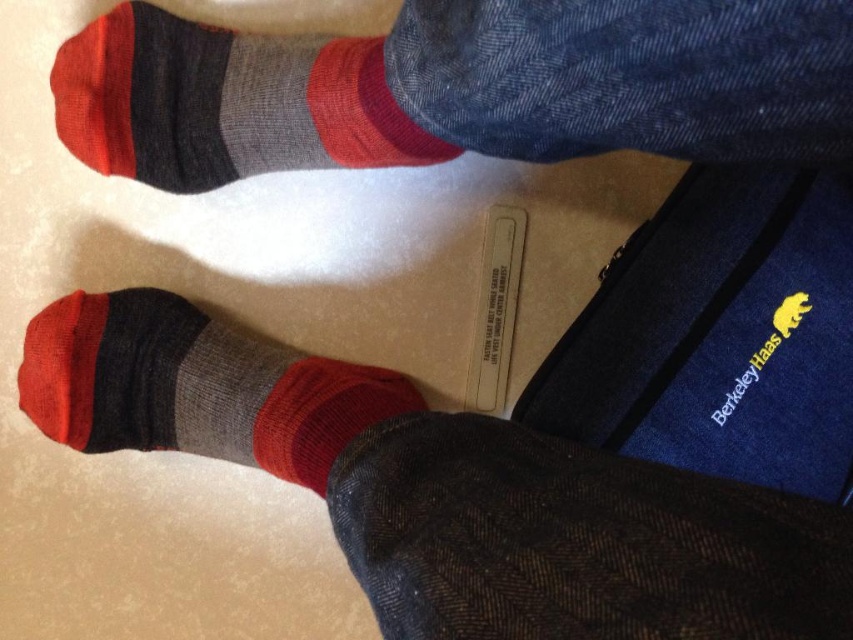
You are taking a photo of the scene and want to focus on the point closer to the camera. Which point should you choose between point (297,422) and point (347,122)?

Point (347,122) is closer to the camera than point (297,422), so you should focus on point (347,122).